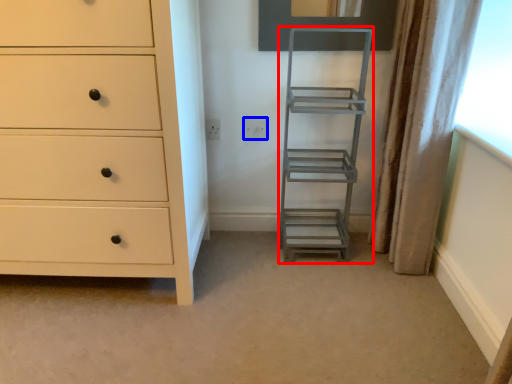
Question: Which object appears farthest to the camera in this image, ladder (highlighted by a red box) or electric outlet (highlighted by a blue box)?

Choices:
 (A) ladder
 (B) electric outlet

Answer: (B)